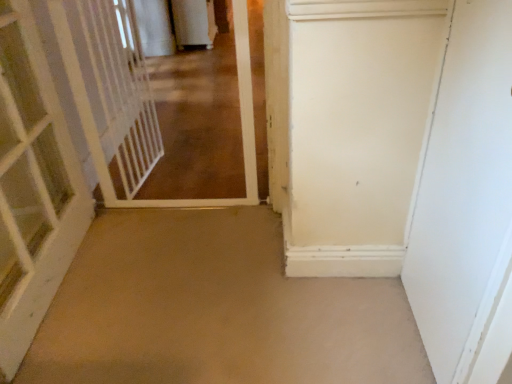
You are a GUI agent. You are given a task and a screenshot of the screen. Output one action in this format:
    pyautogui.click(x=<x>, y=<y>)
    Task: Click on the vacant space underneath white wooden door at left, the 2th door viewed from the right (from a real-world perspective)
    
    Given the screenshot: What is the action you would take?
    pyautogui.click(x=49, y=302)